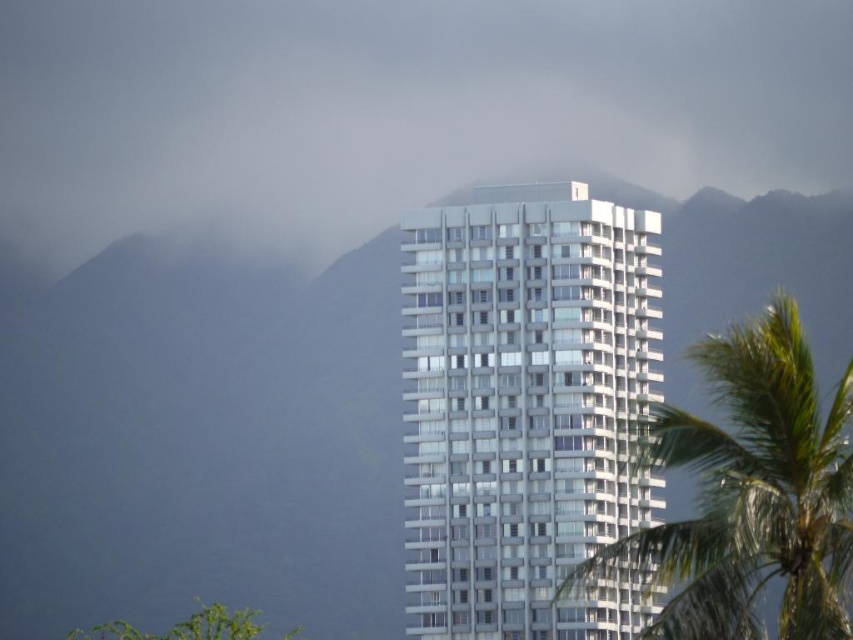
Does transparent fog at center have a larger size compared to green leafy tree at lower left?

Incorrect, transparent fog at center is not larger than green leafy tree at lower left.

Which of these two, transparent fog at center or green leafy tree at lower left, stands taller?

transparent fog at center is taller.

This screenshot has width=853, height=640. Find the location of `transparent fog at center`. transparent fog at center is located at coordinates (395, 108).

I want to click on transparent fog at center, so click(x=395, y=108).

The image size is (853, 640). I want to click on gray matte mountain at center, so click(202, 444).

Can you confirm if gray matte mountain at center is positioned below green leafy palm tree at right?

Indeed, gray matte mountain at center is positioned under green leafy palm tree at right.

Is point (4, 349) farther from camera compared to point (773, 458)?

Yes, it is.

Locate an element on the screen. Image resolution: width=853 pixels, height=640 pixels. gray matte mountain at center is located at coordinates [202, 444].

Based on the photo, does transparent fog at center have a lesser height compared to green leafy palm tree at right?

Incorrect, transparent fog at center's height does not fall short of green leafy palm tree at right's.

Which is behind, point (64, 68) or point (784, 625)?

The point (64, 68) is more distant.

Locate an element on the screen. This screenshot has width=853, height=640. transparent fog at center is located at coordinates (395, 108).